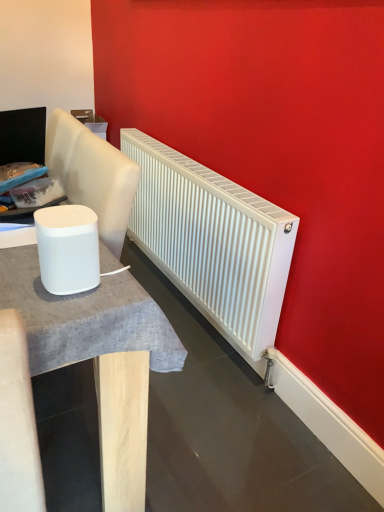
Question: From a real-world perspective, is white matte table at left on white matte radiator at center?

Choices:
 (A) yes
 (B) no

Answer: (B)

Question: Does white matte table at left have a larger size compared to white matte radiator at center?

Choices:
 (A) yes
 (B) no

Answer: (A)

Question: From the image's perspective, is white matte table at left located above white matte radiator at center?

Choices:
 (A) yes
 (B) no

Answer: (B)

Question: Can you confirm if white matte table at left is taller than white matte radiator at center?

Choices:
 (A) yes
 (B) no

Answer: (A)

Question: Is white matte table at left outside white matte radiator at center?

Choices:
 (A) no
 (B) yes

Answer: (B)

Question: Considering the positions of point (145, 311) and point (148, 184), is point (145, 311) closer or farther from the camera than point (148, 184)?

Choices:
 (A) closer
 (B) farther

Answer: (A)

Question: From the image's perspective, is white matte table at left positioned above or below white matte radiator at center?

Choices:
 (A) below
 (B) above

Answer: (A)

Question: From a real-world perspective, is white matte table at left above or below white matte radiator at center?

Choices:
 (A) below
 (B) above

Answer: (A)

Question: Considering the relative positions of white matte table at left and white matte radiator at center in the image provided, is white matte table at left to the left or to the right of white matte radiator at center?

Choices:
 (A) left
 (B) right

Answer: (A)

Question: From the image's perspective, relative to white matte radiator at center, is white matte speaker at left above or below?

Choices:
 (A) below
 (B) above

Answer: (A)

Question: Is white matte speaker at left bigger or smaller than white matte radiator at center?

Choices:
 (A) big
 (B) small

Answer: (B)

Question: In terms of height, does white matte speaker at left look taller or shorter compared to white matte radiator at center?

Choices:
 (A) tall
 (B) short

Answer: (B)

Question: Looking at their shapes, would you say white matte speaker at left is wider or thinner than white matte radiator at center?

Choices:
 (A) wide
 (B) thin

Answer: (B)

Question: In terms of height, does white matte radiator at center look taller or shorter compared to white matte speaker at left?

Choices:
 (A) short
 (B) tall

Answer: (B)

Question: From the image's perspective, is white matte radiator at center positioned above or below white matte speaker at left?

Choices:
 (A) below
 (B) above

Answer: (B)